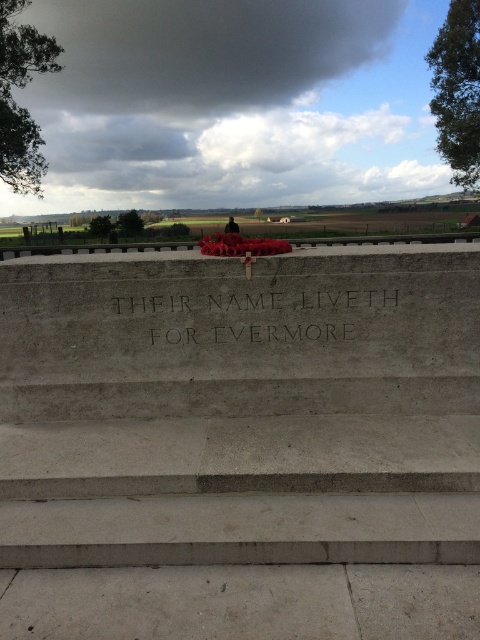
Question: Among these objects, which one is farthest from the camera?

Choices:
 (A) black stone engraving at center
 (B) gray concrete stairs at center

Answer: (A)

Question: Observing the image, what is the correct spatial positioning of gray concrete stairs at center in reference to black stone engraving at center?

Choices:
 (A) above
 (B) below

Answer: (B)

Question: Is gray concrete stairs at center wider than black stone engraving at center?

Choices:
 (A) no
 (B) yes

Answer: (B)

Question: Is the position of gray concrete stairs at center more distant than that of black stone engraving at center?

Choices:
 (A) no
 (B) yes

Answer: (A)